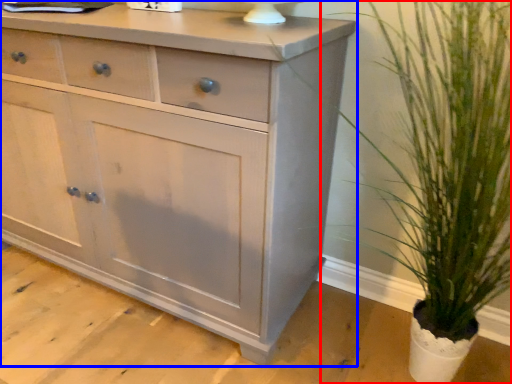
Question: Which of the following is the closest to the observer, houseplant (highlighted by a red box) or chest of drawers (highlighted by a blue box)?

Choices:
 (A) houseplant
 (B) chest of drawers

Answer: (A)